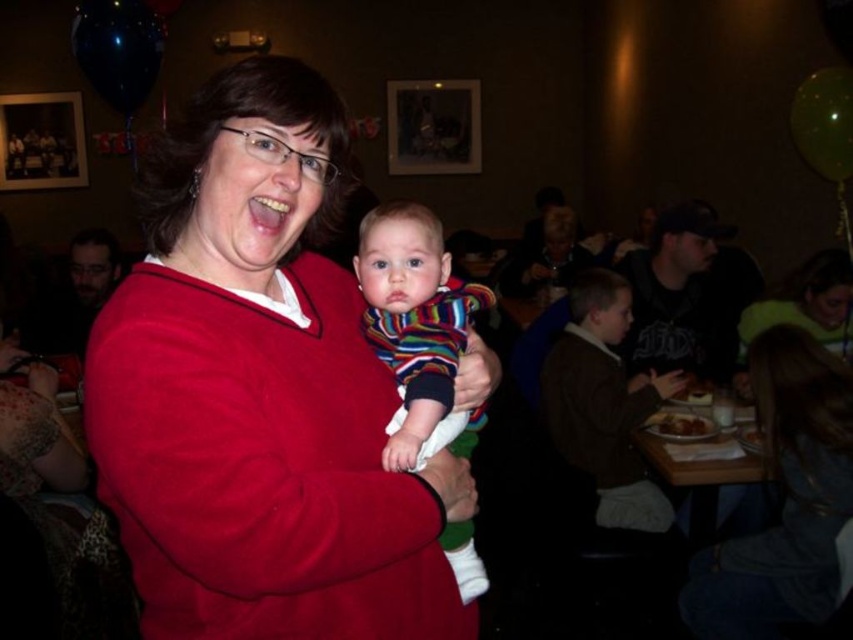
Question: Does matte red sweater at center have a greater width compared to striped fabric baby at center?

Choices:
 (A) yes
 (B) no

Answer: (A)

Question: Does matte red sweater at center appear under striped fabric baby at center?

Choices:
 (A) no
 (B) yes

Answer: (A)

Question: Which of the following is the farthest from the observer?

Choices:
 (A) (428, 333)
 (B) (262, 296)

Answer: (A)

Question: From the image, what is the correct spatial relationship of matte red sweater at center in relation to striped fabric baby at center?

Choices:
 (A) right
 (B) left

Answer: (B)